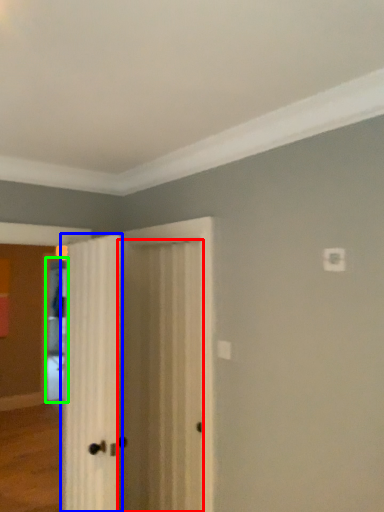
Question: Based on their relative distances, which object is nearer to door (highlighted by a red box)? Choose from door (highlighted by a blue box) and screen door (highlighted by a green box).

Choices:
 (A) door
 (B) screen door

Answer: (A)